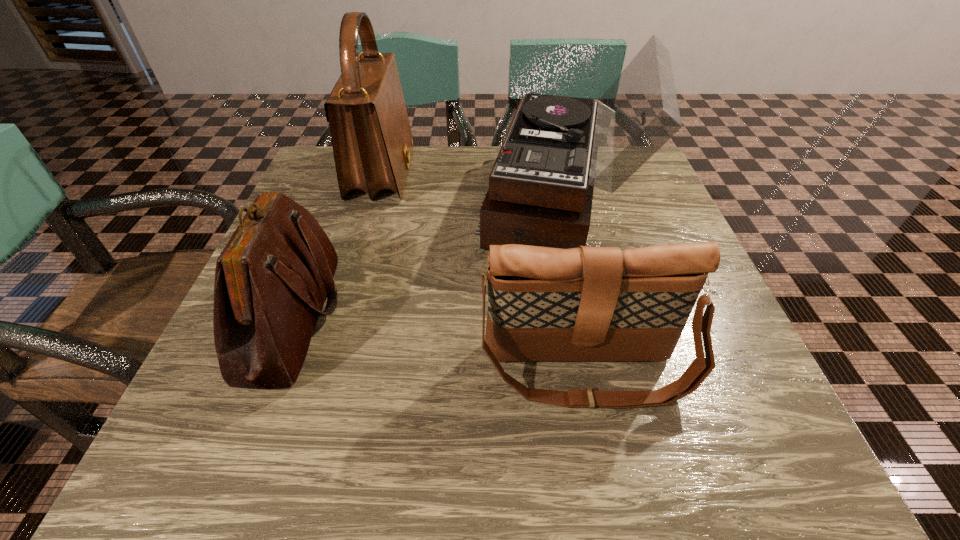
The width and height of the screenshot is (960, 540). Find the location of `the farthest shoulder bag`. the farthest shoulder bag is located at coordinates (372, 142).

The height and width of the screenshot is (540, 960). Find the location of `record player`. record player is located at coordinates (557, 149).

Where is `the rightmost shoulder bag`? the rightmost shoulder bag is located at coordinates (586, 303).

Where is `vacant region located on the front flap of the farthest shoulder bag`? vacant region located on the front flap of the farthest shoulder bag is located at coordinates (549, 174).

What are the coordinates of `vacant space situated on the front of the record player` in the screenshot? It's located at (610, 417).

Find the location of a particular element. The width and height of the screenshot is (960, 540). vacant area situated 0.070m on the front-facing side of the rightmost shoulder bag is located at coordinates (603, 461).

Find the location of a particular element. The image size is (960, 540). shoulder bag positioned at the far edge is located at coordinates (372, 142).

The width and height of the screenshot is (960, 540). I want to click on record player that is at the far edge, so click(x=557, y=149).

The height and width of the screenshot is (540, 960). What are the coordinates of `object located in the near edge section of the desktop` in the screenshot? It's located at (586, 303).

Identify the location of record player at the right edge. This screenshot has width=960, height=540. (557, 149).